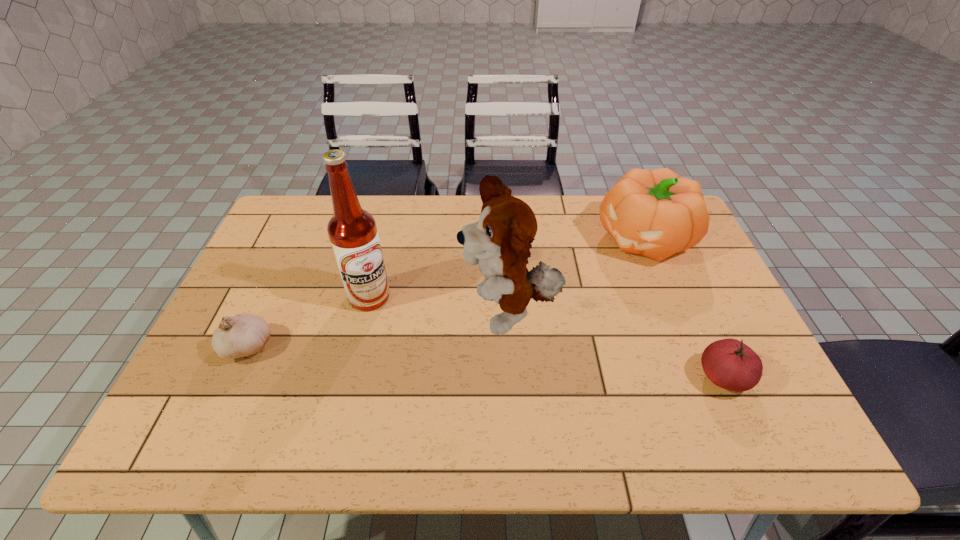
You are a GUI agent. You are given a task and a screenshot of the screen. Output one action in this format:
    pyautogui.click(x=<x>, y=<y>)
    Task: Click on the object that stands as the third closest to the tomato
    Image resolution: width=960 pixels, height=540 pixels.
    Given the screenshot: What is the action you would take?
    pyautogui.click(x=352, y=231)

At what (x,y) coordinates should I click in order to perform the action: click on free spot that satisfies the following two spatial constraints: 1. on the back side of the leftmost object; 2. on the right side of the farthest object. Please return your answer as a coordinate pair (x, y). This screenshot has height=540, width=960. Looking at the image, I should click on (296, 238).

You are a GUI agent. You are given a task and a screenshot of the screen. Output one action in this format:
    pyautogui.click(x=<x>, y=<y>)
    Task: Click on the vacant space that satisfies the following two spatial constraints: 1. on the front side of the farthest object; 2. on the left side of the tomato
    The height and width of the screenshot is (540, 960).
    Given the screenshot: What is the action you would take?
    pyautogui.click(x=702, y=377)

You are a GUI agent. You are given a task and a screenshot of the screen. Output one action in this format:
    pyautogui.click(x=<x>, y=<y>)
    Task: Click on the vacant area in the image that satisfies the following two spatial constraints: 1. on the back side of the farthest object; 2. on the right side of the fourth object from right to left
    
    Given the screenshot: What is the action you would take?
    pyautogui.click(x=383, y=238)

Identify the location of vacant space that satisfies the following two spatial constraints: 1. on the back side of the alcohol; 2. on the left side of the farthest object. (383, 238).

At what (x,y) coordinates should I click in order to perform the action: click on vacant space that satisfies the following two spatial constraints: 1. on the back side of the garlic; 2. on the right side of the farthest object. Please return your answer as a coordinate pair (x, y). The height and width of the screenshot is (540, 960). Looking at the image, I should click on (296, 238).

I want to click on vacant position in the image that satisfies the following two spatial constraints: 1. on the back side of the alcohol; 2. on the left side of the leftmost object, so [x=270, y=297].